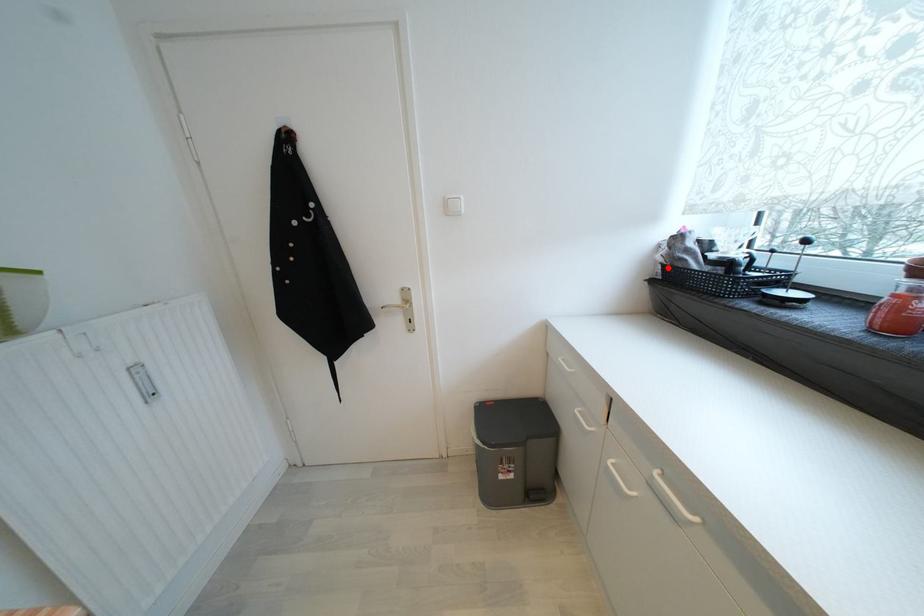
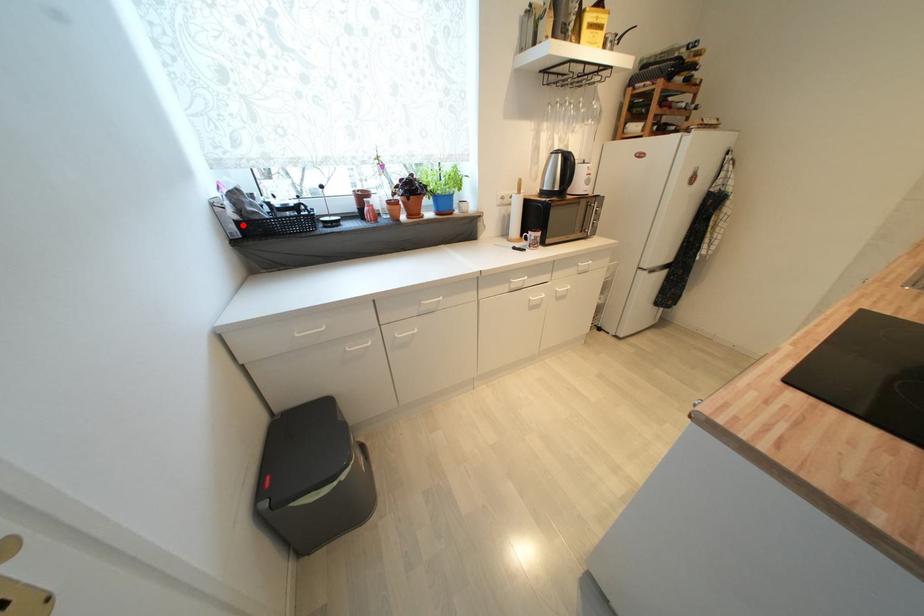
I am providing you with two images of the same scene from different viewpoints. A red point is marked on the first image and another point is marked on the second image. Is the red point in image1 aligned with the point shown in image2?

Yes